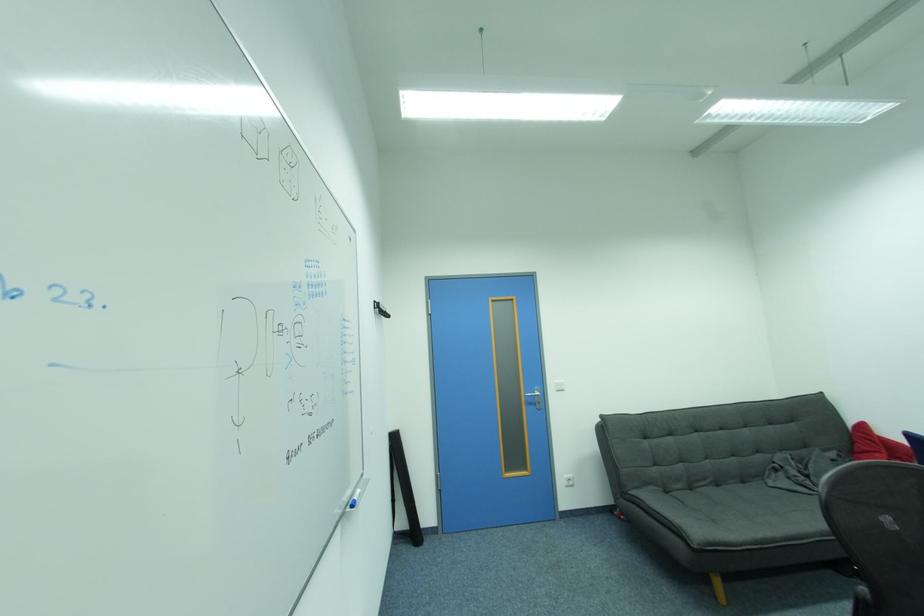
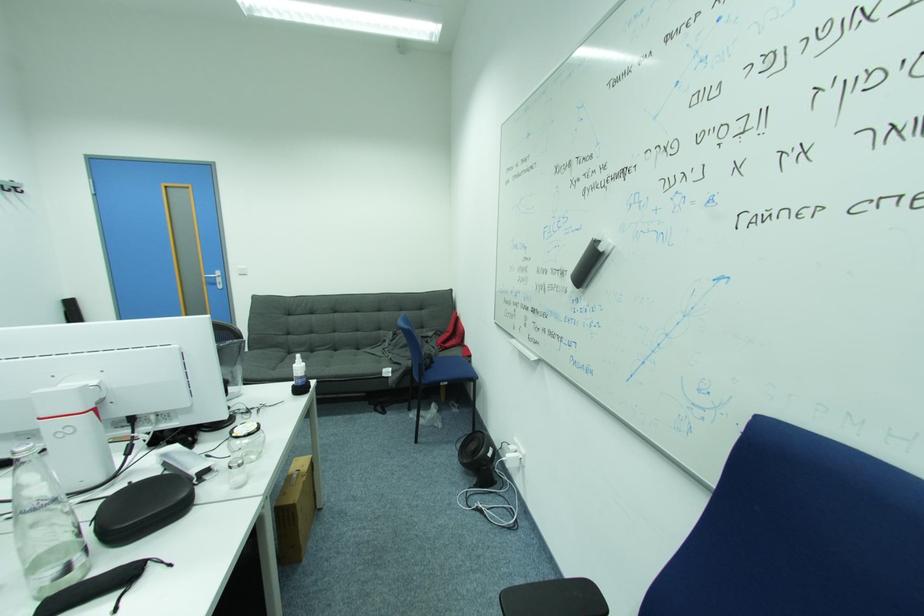
The point at [775,469] is marked in the first image. Where is the corresponding point in the second image?

(388, 341)